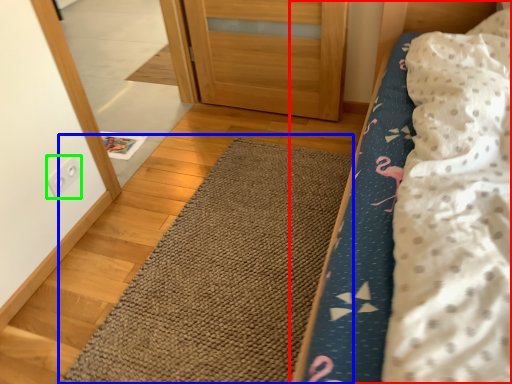
Question: Which object is the farthest from bed (highlighted by a red box)? Choose among these: doormat (highlighted by a blue box) or electric outlet (highlighted by a green box).

Choices:
 (A) doormat
 (B) electric outlet

Answer: (B)